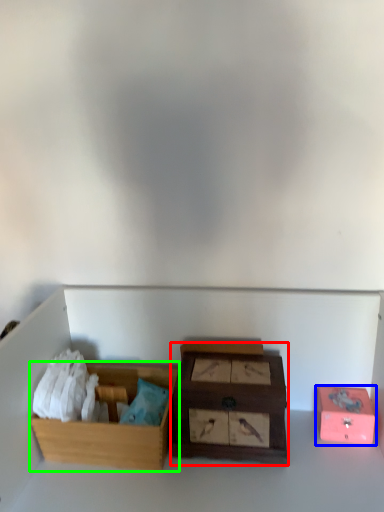
Question: Considering the real-world distances, which object is closest to box (highlighted by a red box)? box (highlighted by a blue box) or box (highlighted by a green box).

Choices:
 (A) box
 (B) box

Answer: (B)